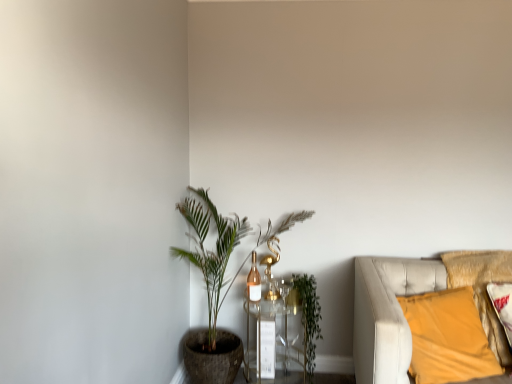
Question: Does velvet yellow pillow at right have a lesser width compared to green leafy plant at center-left?

Choices:
 (A) yes
 (B) no

Answer: (A)

Question: From the image's perspective, would you say velvet yellow pillow at right is shown under green leafy plant at center-left?

Choices:
 (A) no
 (B) yes

Answer: (B)

Question: Can green leafy plant at center-left be found inside velvet yellow pillow at right?

Choices:
 (A) yes
 (B) no

Answer: (B)

Question: Does velvet yellow pillow at right have a larger size compared to green leafy plant at center-left?

Choices:
 (A) no
 (B) yes

Answer: (A)

Question: Is velvet yellow pillow at right positioned far away from green leafy plant at center-left?

Choices:
 (A) no
 (B) yes

Answer: (A)

Question: Considering the positions of green leafy plant at center-left and velvet yellow pillow at right in the image, is green leafy plant at center-left bigger or smaller than velvet yellow pillow at right?

Choices:
 (A) small
 (B) big

Answer: (B)

Question: From a real-world perspective, is green leafy plant at center-left above or below velvet yellow pillow at right?

Choices:
 (A) below
 (B) above

Answer: (B)

Question: Considering the positions of green leafy plant at center-left and velvet yellow pillow at right in the image, is green leafy plant at center-left wider or thinner than velvet yellow pillow at right?

Choices:
 (A) wide
 (B) thin

Answer: (A)

Question: From the image's perspective, is green leafy plant at center-left above or below velvet yellow pillow at right?

Choices:
 (A) below
 (B) above

Answer: (B)

Question: From a real-world perspective, is velvet yellow pillow at right physically located above or below green leafy plant at center?

Choices:
 (A) below
 (B) above

Answer: (B)

Question: From the image's perspective, is velvet yellow pillow at right positioned above or below green leafy plant at center?

Choices:
 (A) below
 (B) above

Answer: (B)

Question: In terms of width, does velvet yellow pillow at right look wider or thinner when compared to green leafy plant at center?

Choices:
 (A) wide
 (B) thin

Answer: (A)

Question: Does point (365, 332) appear closer or farther from the camera than point (310, 288)?

Choices:
 (A) farther
 (B) closer

Answer: (B)

Question: Is point (221, 365) closer or farther from the camera than point (252, 314)?

Choices:
 (A) closer
 (B) farther

Answer: (A)

Question: In terms of width, does green leafy plant at center-left look wider or thinner when compared to clear glass table at center?

Choices:
 (A) thin
 (B) wide

Answer: (B)